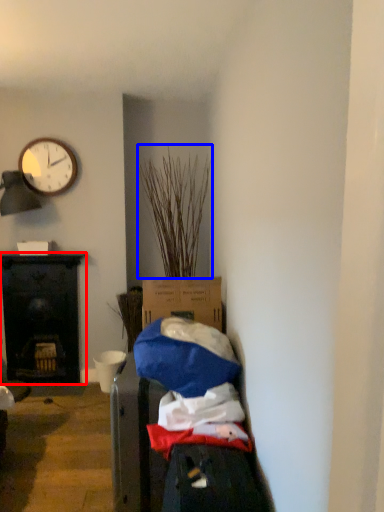
Question: Among these objects, which one is farthest to the camera, desk (highlighted by a red box) or plant (highlighted by a blue box)?

Choices:
 (A) desk
 (B) plant

Answer: (A)